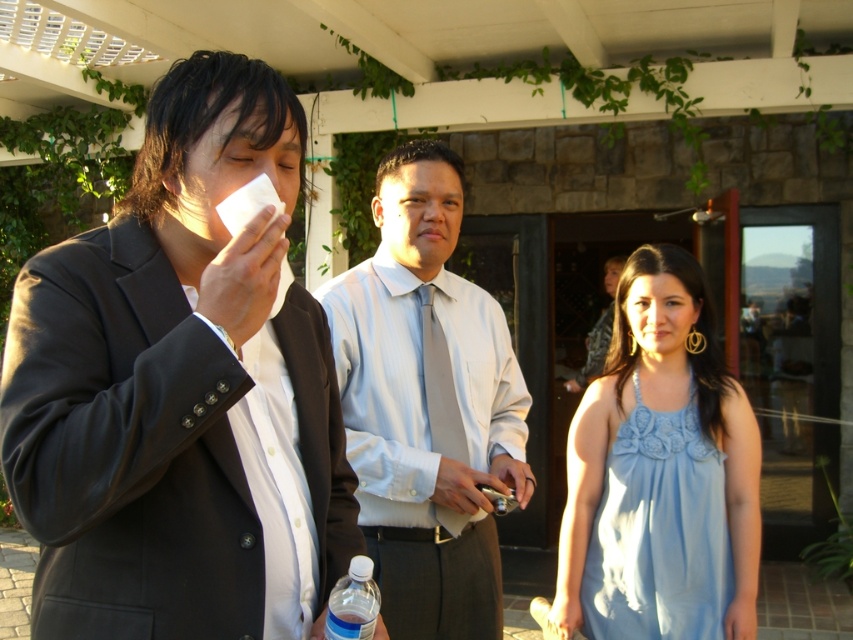
Question: Among these points, which one is nearest to the camera?

Choices:
 (A) pos(361,618)
 (B) pos(45,593)

Answer: (B)

Question: Which of these objects is positioned farthest from the clear plastic bottle at lower center?

Choices:
 (A) black matte suit at left
 (B) light blue fabric dress at center
 (C) light blue shirt at center

Answer: (B)

Question: Which is farther from the light blue fabric dress at center?

Choices:
 (A) clear plastic bottle at lower center
 (B) light blue shirt at center
 (C) black matte suit at left

Answer: (C)

Question: Is light blue shirt at center below light blue fabric dress at center?

Choices:
 (A) no
 (B) yes

Answer: (A)

Question: Can you confirm if light blue shirt at center is bigger than clear plastic bottle at lower center?

Choices:
 (A) no
 (B) yes

Answer: (B)

Question: Does black matte suit at left have a lesser width compared to light blue fabric dress at center?

Choices:
 (A) yes
 (B) no

Answer: (A)